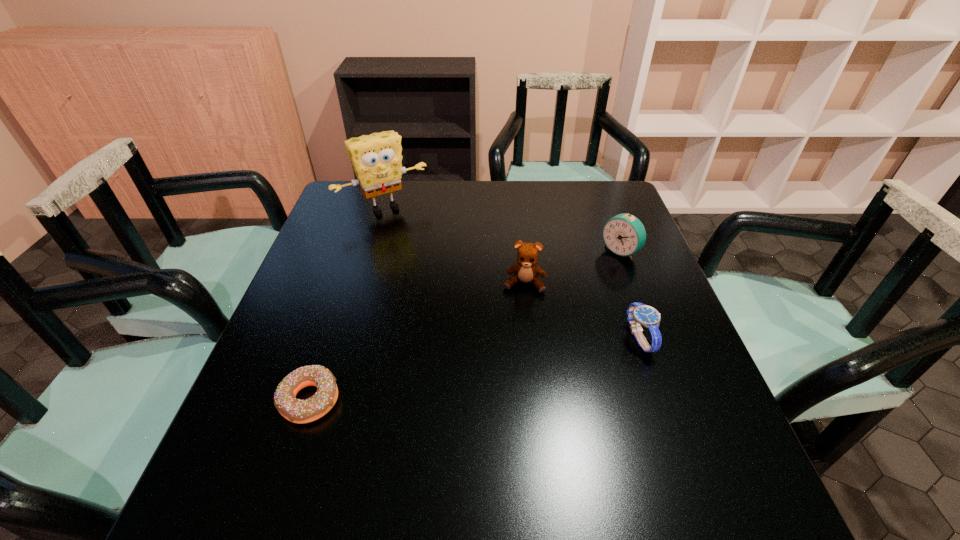
Where is `vacant space that is in between the nearest object and the third object from left to right`? This screenshot has width=960, height=540. vacant space that is in between the nearest object and the third object from left to right is located at coordinates (417, 342).

This screenshot has width=960, height=540. I want to click on free space that is in between the alarm clock and the teddy bear, so click(x=572, y=268).

This screenshot has height=540, width=960. What are the coordinates of `free space between the nearest object and the watch` in the screenshot? It's located at (474, 369).

Select which object appears as the closest to the doughnut. Please provide its 2D coordinates. Your answer should be formatted as a tuple, i.e. [(x, y)], where the tuple contains the x and y coordinates of a point satisfying the conditions above.

[(526, 269)]

Identify which object is the closest to the third farthest object. Please provide its 2D coordinates. Your answer should be formatted as a tuple, i.e. [(x, y)], where the tuple contains the x and y coordinates of a point satisfying the conditions above.

[(624, 234)]

Find the location of a particular element. This screenshot has width=960, height=540. vacant area that satisfies the following two spatial constraints: 1. on the front side of the alarm clock; 2. on the right side of the sponge is located at coordinates (372, 252).

This screenshot has width=960, height=540. What are the coordinates of `free space that satisfies the following two spatial constraints: 1. on the front side of the alarm clock; 2. on the right side of the tallest object` in the screenshot? It's located at (372, 252).